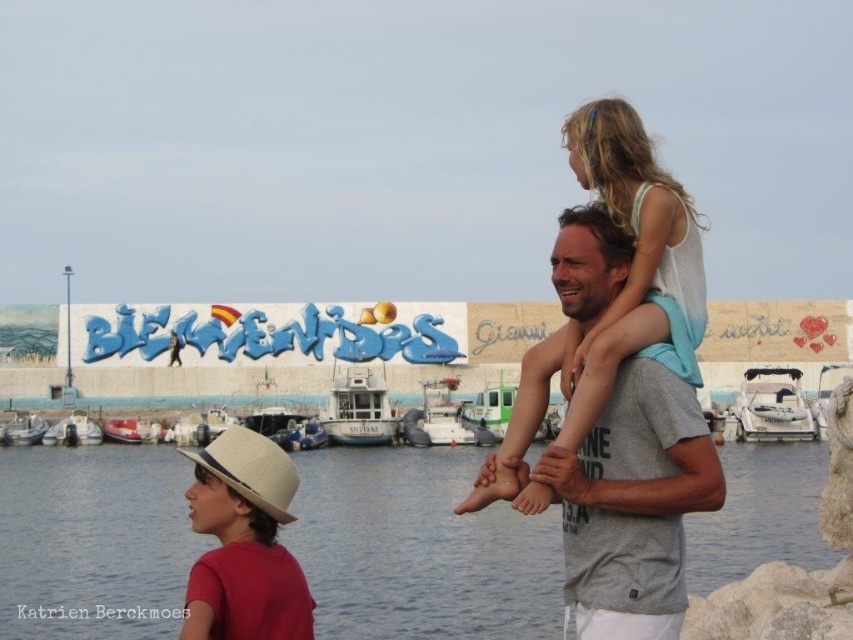
Does gray cotton t-shirt at center have a greater height compared to beige straw hat at upper right?

Indeed, gray cotton t-shirt at center has a greater height compared to beige straw hat at upper right.

Describe the element at coordinates (631, 506) in the screenshot. I see `gray cotton t-shirt at center` at that location.

Where is `gray cotton t-shirt at center`? The width and height of the screenshot is (853, 640). gray cotton t-shirt at center is located at coordinates (631, 506).

Where is `clear water at lower center`? The image size is (853, 640). clear water at lower center is located at coordinates (419, 550).

Can you confirm if clear water at lower center is wider than beige straw hat at upper right?

Yes.

You are a GUI agent. You are given a task and a screenshot of the screen. Output one action in this format:
    pyautogui.click(x=<x>, y=<y>)
    Task: Click on the clear water at lower center
    This screenshot has width=853, height=640.
    Given the screenshot: What is the action you would take?
    pyautogui.click(x=419, y=550)

I want to click on clear water at lower center, so pos(419,550).

Who is positioned more to the left, clear water at lower center or gray cotton t-shirt at center?

Positioned to the left is clear water at lower center.

Is clear water at lower center further to the viewer compared to gray cotton t-shirt at center?

Yes, clear water at lower center is behind gray cotton t-shirt at center.

Describe the element at coordinates (419, 550) in the screenshot. I see `clear water at lower center` at that location.

The height and width of the screenshot is (640, 853). What are the coordinates of `clear water at lower center` in the screenshot? It's located at (419, 550).